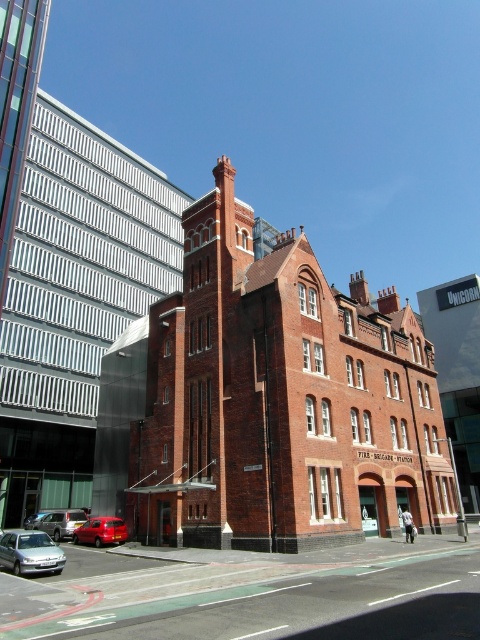
Question: Is silver metallic sedan at lower left behind silver metallic car at center?

Choices:
 (A) yes
 (B) no

Answer: (B)

Question: Which object is positioned farthest from the silver metallic sedan at lower left?

Choices:
 (A) silver metallic car at center
 (B) metallic red van at center

Answer: (A)

Question: Does metallic red van at center come behind silver metallic car at center?

Choices:
 (A) no
 (B) yes

Answer: (A)

Question: Which of the following is the closest to the observer?

Choices:
 (A) metallic red van at center
 (B) silver metallic car at center
 (C) silver metallic sedan at lower left

Answer: (C)

Question: Does silver metallic sedan at lower left appear over metallic red van at center?

Choices:
 (A) no
 (B) yes

Answer: (B)

Question: Which point is closer to the camera taking this photo?

Choices:
 (A) (20, 556)
 (B) (56, 538)

Answer: (A)